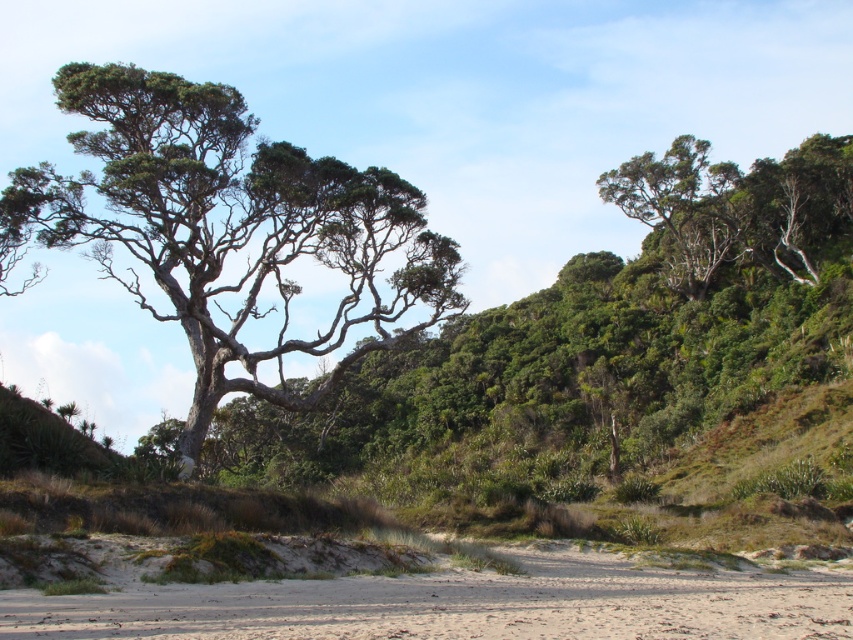
You are standing on the light brown sandy beach at lower center and want to reach the smooth gray bark tree at center. Which direction should you move to get closer to the tree?

You should move upward towards the smooth gray bark tree at center since it is located above the light brown sandy beach at lower center.